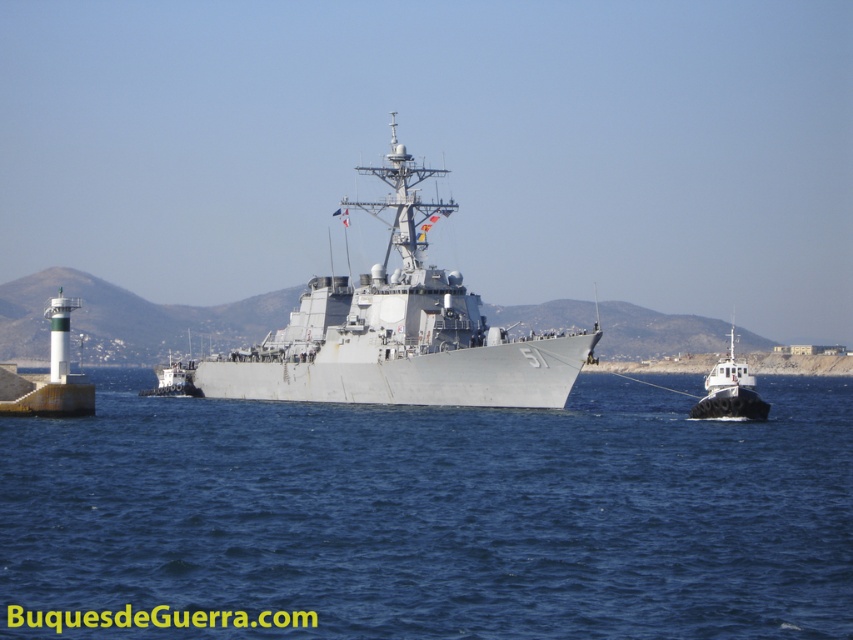
Question: Considering the real-world distances, which object is closest to the gray metallic warship at center?

Choices:
 (A) white matte tugboat at right
 (B) blue water at center

Answer: (B)

Question: From the image, what is the correct spatial relationship of gray metallic warship at center in relation to white matte tugboat at right?

Choices:
 (A) below
 (B) above

Answer: (B)

Question: Which of the following is the farthest from the observer?

Choices:
 (A) (395, 196)
 (B) (439, 636)

Answer: (A)

Question: Is blue water at center in front of gray metallic warship at center?

Choices:
 (A) yes
 (B) no

Answer: (A)

Question: Which object is positioned farthest from the blue water at center?

Choices:
 (A) white matte tugboat at right
 (B) gray metallic warship at center

Answer: (A)

Question: Where is gray metallic warship at center located in relation to white matte tugboat at right in the image?

Choices:
 (A) left
 (B) right

Answer: (A)